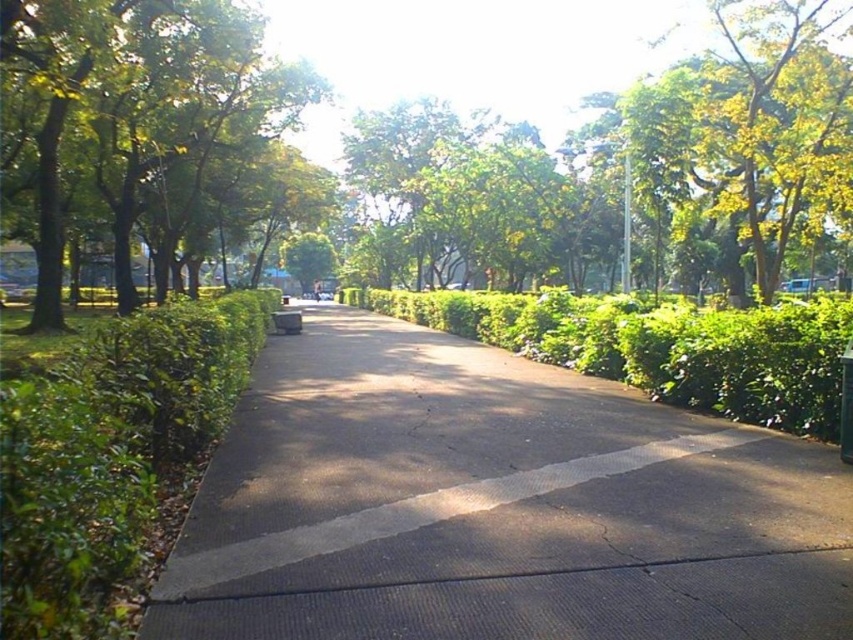
Question: Observing the image, what is the correct spatial positioning of dark gray asphalt at center in reference to green leafy hedge at center?

Choices:
 (A) right
 (B) left

Answer: (B)

Question: Which object is farther from the camera taking this photo?

Choices:
 (A) green leafy hedge at center
 (B) green leafy hedge at left
 (C) green leafy tree at center

Answer: (C)

Question: Can you confirm if dark gray asphalt at center is wider than green leafy tree at left?

Choices:
 (A) yes
 (B) no

Answer: (B)

Question: Which point appears closest to the camera in this image?

Choices:
 (A) (277, 65)
 (B) (641, 360)
 (C) (508, 253)

Answer: (B)

Question: Does dark gray asphalt at center have a greater width compared to green leafy tree at left?

Choices:
 (A) yes
 (B) no

Answer: (B)

Question: Which object is positioned closest to the green leafy hedge at left?

Choices:
 (A) green leafy hedge at center
 (B) dark gray asphalt at center

Answer: (B)